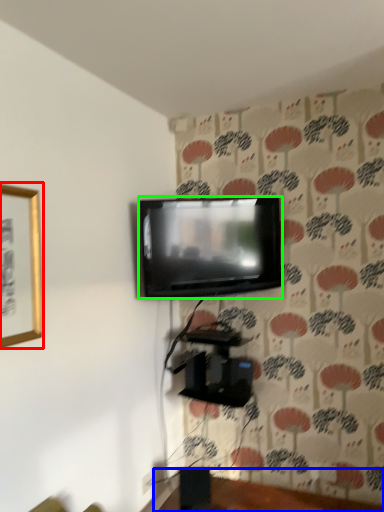
Question: Based on their relative distances, which object is nearer to picture frame (highlighted by a red box)? Choose from furniture (highlighted by a blue box) and television (highlighted by a green box).

Choices:
 (A) furniture
 (B) television

Answer: (B)